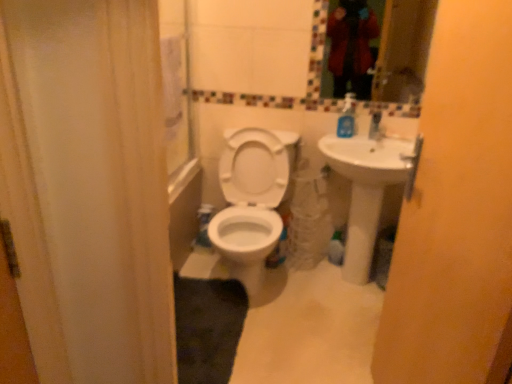
Question: Does matte yellow screen door at right turn towards glassy mosaic mirror at upper center?

Choices:
 (A) yes
 (B) no

Answer: (B)

Question: Is glassy mosaic mirror at upper center completely or partially inside matte yellow screen door at right?

Choices:
 (A) yes
 (B) no

Answer: (B)

Question: From a real-world perspective, is matte yellow screen door at right on glassy mosaic mirror at upper center?

Choices:
 (A) yes
 (B) no

Answer: (B)

Question: Is matte yellow screen door at right not inside glassy mosaic mirror at upper center?

Choices:
 (A) no
 (B) yes

Answer: (B)

Question: Is matte yellow screen door at right further to the viewer compared to glassy mosaic mirror at upper center?

Choices:
 (A) no
 (B) yes

Answer: (A)

Question: Considering the positions of matte yellow screen door at right and white glossy sink at right in the image, is matte yellow screen door at right taller or shorter than white glossy sink at right?

Choices:
 (A) short
 (B) tall

Answer: (B)

Question: From the image's perspective, is matte yellow screen door at right located above or below white glossy sink at right?

Choices:
 (A) above
 (B) below

Answer: (B)

Question: In terms of size, does matte yellow screen door at right appear bigger or smaller than white glossy sink at right?

Choices:
 (A) small
 (B) big

Answer: (A)

Question: Looking at their shapes, would you say matte yellow screen door at right is wider or thinner than white glossy sink at right?

Choices:
 (A) wide
 (B) thin

Answer: (B)

Question: In terms of size, does matte yellow screen door at right appear bigger or smaller than white glossy toilet at center?

Choices:
 (A) big
 (B) small

Answer: (B)

Question: Visually, is matte yellow screen door at right positioned to the left or to the right of white glossy toilet at center?

Choices:
 (A) right
 (B) left

Answer: (A)

Question: Is matte yellow screen door at right taller or shorter than white glossy toilet at center?

Choices:
 (A) short
 (B) tall

Answer: (B)

Question: Is point (444, 354) closer or farther from the camera than point (233, 180)?

Choices:
 (A) farther
 (B) closer

Answer: (B)

Question: In terms of width, does matte yellow screen door at right look wider or thinner when compared to blue plastic soap dispenser at upper right?

Choices:
 (A) wide
 (B) thin

Answer: (A)

Question: Is matte yellow screen door at right spatially inside blue plastic soap dispenser at upper right, or outside of it?

Choices:
 (A) outside
 (B) inside

Answer: (A)